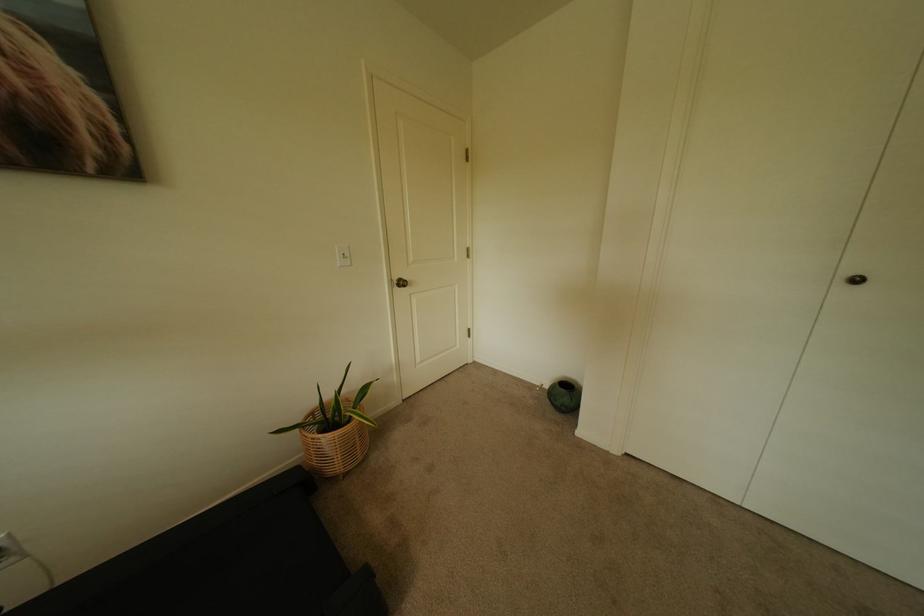
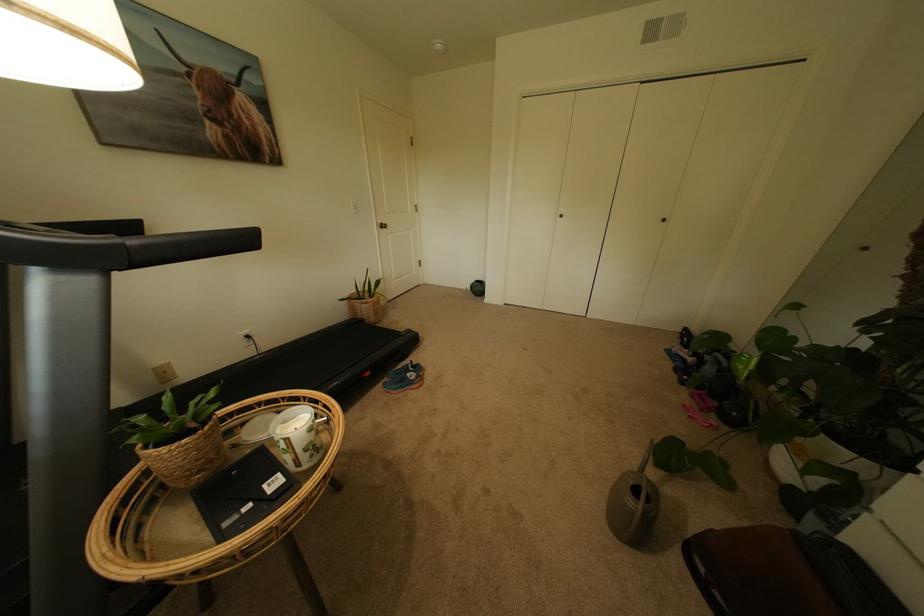
In a continuous first-person perspective shot, in which direction is the camera moving?

The cameraman walked toward left, backward.